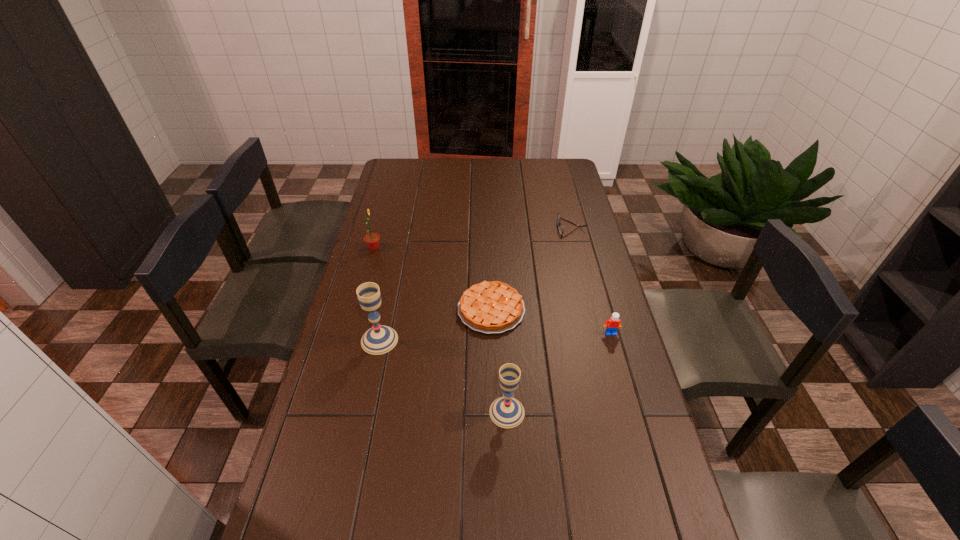
Image resolution: width=960 pixels, height=540 pixels. What are the coordinates of `vacant space located on the front of the shorter chalice` in the screenshot? It's located at (509, 450).

Locate an element on the screen. vacant point located 0.300m on the face of the fifth nearest object is located at coordinates 457,248.

Locate an element on the screen. The width and height of the screenshot is (960, 540). vacant space situated on the front-facing side of the farthest object is located at coordinates (519, 227).

The width and height of the screenshot is (960, 540). Find the location of `vacant position located on the front-facing side of the farthest object`. vacant position located on the front-facing side of the farthest object is located at coordinates (542, 227).

At what (x,y) coordinates should I click in order to perform the action: click on free space located 0.070m on the front-facing side of the farthest object. Please return your answer as a coordinate pair (x, y). This screenshot has width=960, height=540. Looking at the image, I should click on (540, 227).

The image size is (960, 540). Identify the location of blank area located 0.400m on the face of the fourth tallest object. (645, 456).

This screenshot has height=540, width=960. In order to click on vacant space located 0.090m on the left of the pie in this screenshot , I will do `click(431, 309)`.

Identify the location of chalice that is at the left edge. (380, 339).

Image resolution: width=960 pixels, height=540 pixels. What are the coordinates of `sunflower located in the left edge section of the desktop` in the screenshot? It's located at (372, 240).

Locate an element on the screen. This screenshot has width=960, height=540. spectacles that is at the right edge is located at coordinates (560, 227).